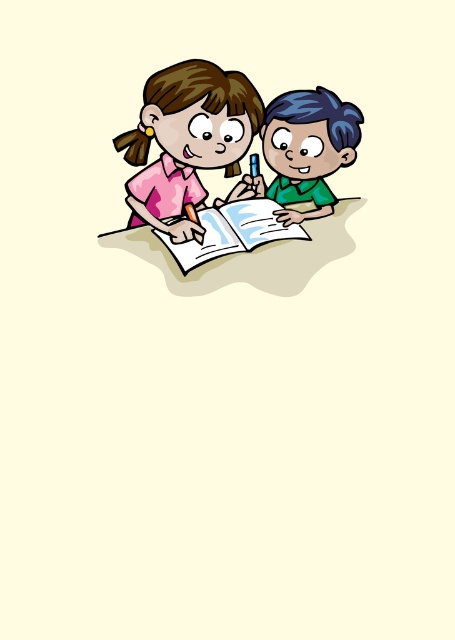
Question: Does matte pink shirt at upper left have a lesser width compared to paperback book at center?

Choices:
 (A) no
 (B) yes

Answer: (A)

Question: From the image, what is the correct spatial relationship of green matte shirt at right in relation to paperback book at center?

Choices:
 (A) right
 (B) left

Answer: (A)

Question: Does pink matte shirt at upper left appear on the right side of green matte shirt at right?

Choices:
 (A) no
 (B) yes

Answer: (A)

Question: Which point is farther to the camera?

Choices:
 (A) matte pink shirt at upper left
 (B) green matte shirt at right
 (C) pink matte shirt at upper left

Answer: (B)

Question: Which point appears closest to the camera in this image?

Choices:
 (A) (308, 236)
 (B) (171, 218)
 (C) (186, 74)

Answer: (A)

Question: Estimate the real-world distances between objects in this image. Which object is closer to the matte pink shirt at upper left?

Choices:
 (A) paperback book at center
 (B) green matte shirt at right

Answer: (B)